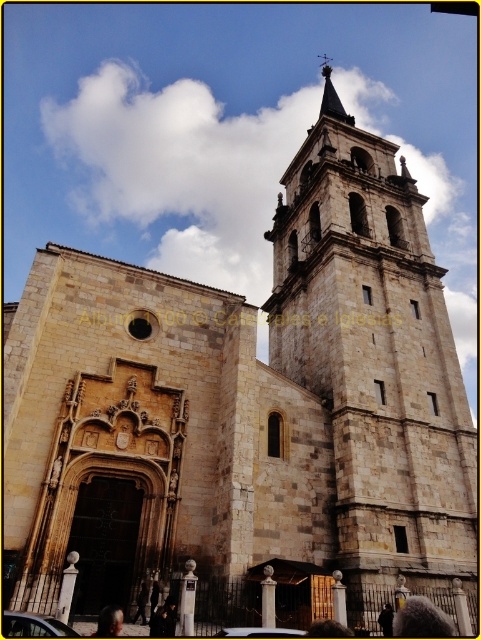
Which of these two, stone tower at center or smooth gray stone spire at upper center, stands taller?

With more height is smooth gray stone spire at upper center.

Does stone tower at center have a smaller size compared to smooth gray stone spire at upper center?

Correct, stone tower at center occupies less space than smooth gray stone spire at upper center.

Does point (321, 147) come farther from viewer compared to point (330, 67)?

No, it is not.

This screenshot has height=640, width=481. What are the coordinates of `stone tower at center` in the screenshot? It's located at (374, 358).